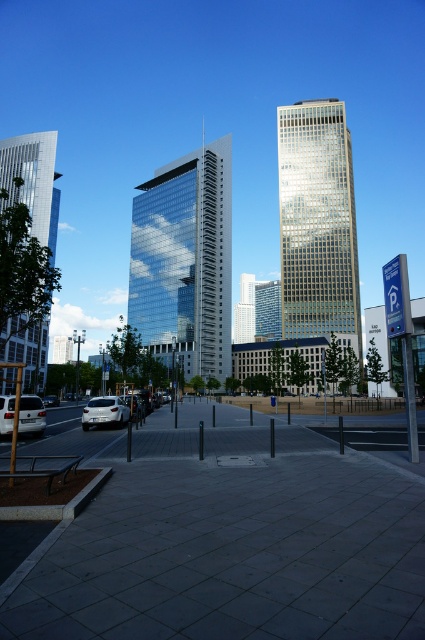
Can you confirm if gray concrete pavement at center is bigger than white glossy sedan at lower left?

Yes.

Is gray concrete pavement at center to the right of white glossy sedan at lower left from the viewer's perspective?

Yes, gray concrete pavement at center is to the right of white glossy sedan at lower left.

What do you see at coordinates (232, 540) in the screenshot? This screenshot has height=640, width=425. I see `gray concrete pavement at center` at bounding box center [232, 540].

Where is `gray concrete pavement at center`? This screenshot has height=640, width=425. gray concrete pavement at center is located at coordinates (232, 540).

Who is shorter, glassy reflective skyscraper at left or white glossy car at lower left?

With less height is white glossy car at lower left.

Between point (30, 163) and point (57, 404), which one is positioned in front?

Positioned in front is point (57, 404).

Find the location of a particular element. The height and width of the screenshot is (640, 425). glassy reflective skyscraper at left is located at coordinates (34, 180).

Between gold glass skyscraper at center and white glossy sedan at lower left, which one appears on the left side from the viewer's perspective?

Positioned to the left is white glossy sedan at lower left.

Is gold glass skyscraper at center wider than white glossy sedan at lower left?

Yes, gold glass skyscraper at center is wider than white glossy sedan at lower left.

Does point (351, 173) come farther from viewer compared to point (125, 403)?

Yes.

Identify the location of gold glass skyscraper at center. (317, 221).